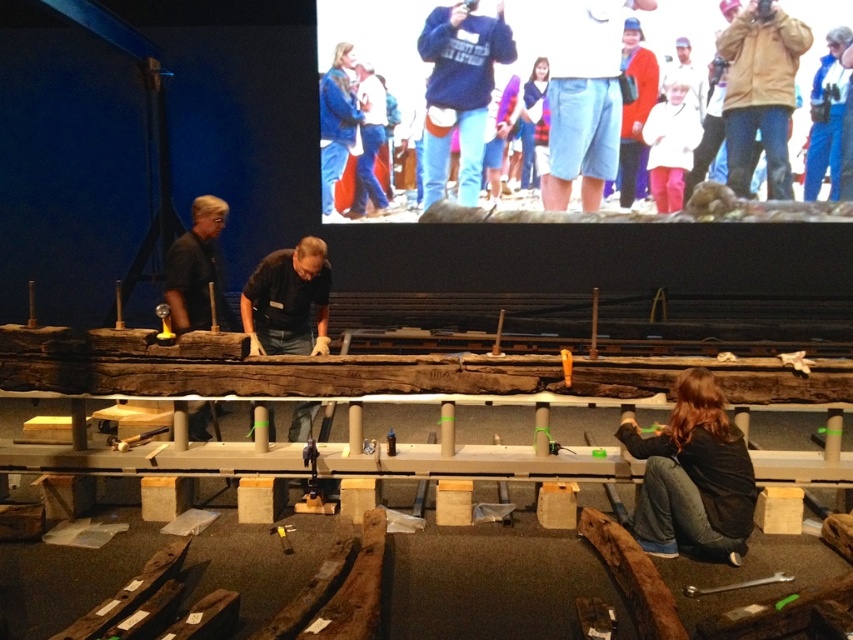
Question: Is blue denim jeans at upper center to the left of matte red sweater at upper right from the viewer's perspective?

Choices:
 (A) no
 (B) yes

Answer: (B)

Question: Estimate the real-world distances between objects in this image. Which object is closer to the black matte shirt at left?

Choices:
 (A) denim shorts at center
 (B) dark brown hair at lower right
 (C) blue denim jeans at upper center
 (D) black matte wood at center

Answer: (D)

Question: Among these points, which one is farthest from the camera?

Choices:
 (A) (733, 68)
 (B) (422, 51)

Answer: (A)

Question: Is black matte shirt at left positioned at the back of blue denim jeans at upper center?

Choices:
 (A) no
 (B) yes

Answer: (A)

Question: Does blue denim jeans at upper center have a smaller size compared to matte red sweater at upper right?

Choices:
 (A) no
 (B) yes

Answer: (A)

Question: Estimate the real-world distances between objects in this image. Which object is farther from the brown leather jacket at upper right?

Choices:
 (A) blue denim jeans at upper center
 (B) blue denim jeans at center

Answer: (A)